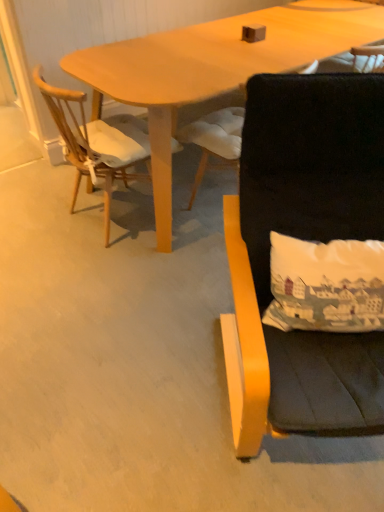
The image size is (384, 512). I want to click on vacant space in between black fabric chair at right, which ranks as the first chair in right-to-left order, and wooden chair at left, which is counted as the third chair, starting from the right, so point(168,292).